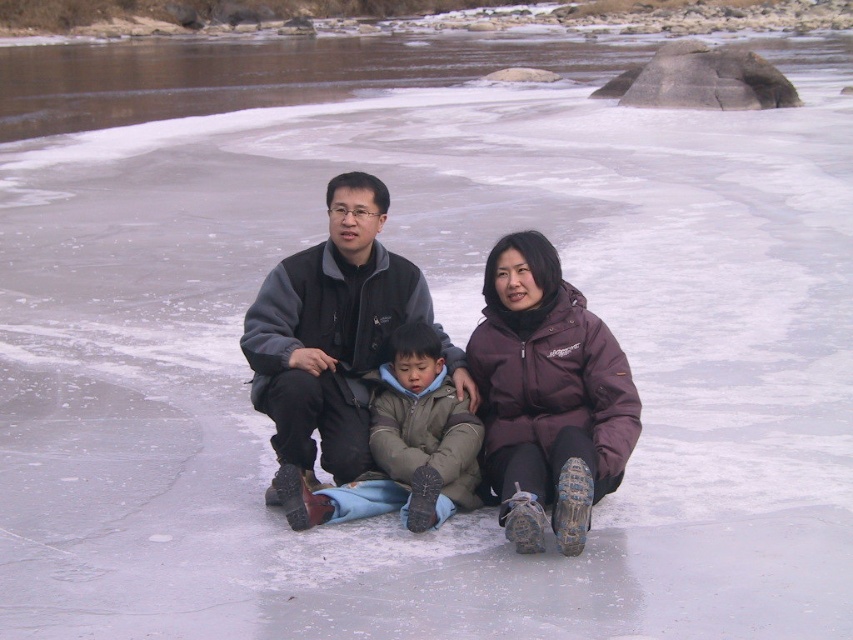
You are planning to take a photo of the two people wearing the dark brown jacket at center and the purple softshell jacket at center. Which one should you zoom in on more to capture their full bodies in the frame?

The dark brown jacket at center has a larger width than the purple softshell jacket at center, so you should zoom in more on the purple softshell jacket at center to ensure both are fully captured in the frame.

You are a photographer trying to capture a group photo of the dark brown jacket at center and the purple softshell jacket at center. If your camera can only focus on objects within 10 inches of each other, will you be able to get a clear photo of both?

The dark brown jacket at center and purple softshell jacket at center are 9.46 inches apart from each other, which is within the 10 inch focus range. Therefore, the photographer can capture both in a clear photo.

You are a photographer trying to capture a clear photo of the dark brown jacket at center and the khaki fleece jacket at center. Since the ice is partially transparent, you notice that the background might blur the subjects. Which jacket should you focus on first to ensure it appears sharp in the photo?

You should focus on the dark brown jacket at center first because it is in front of the khaki fleece jacket at center, making it closer to the camera and thus easier to capture sharply without background blur.